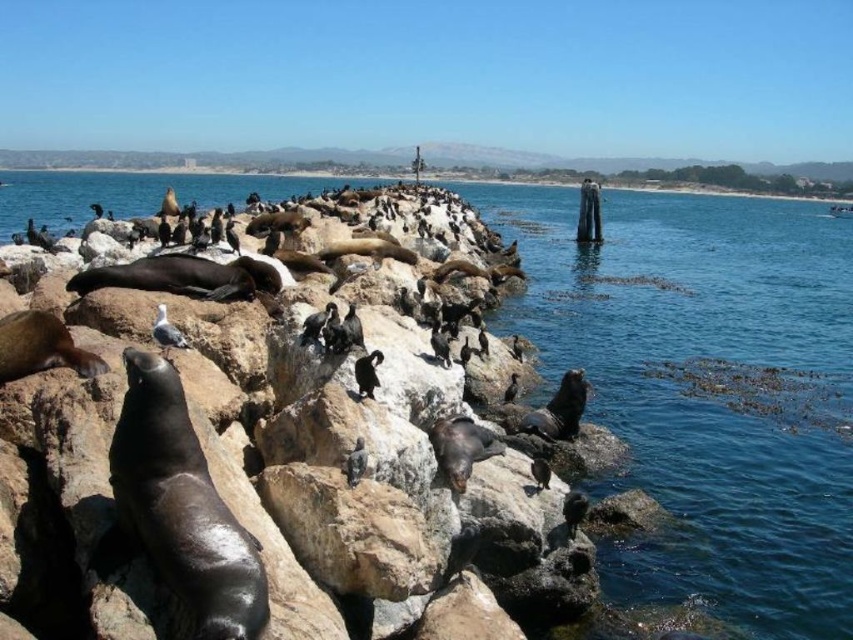
You are a drone operator trying to capture a photo of the coastal scene. You have two points marked on your screen, point A at point[810,211] and point B at point[4,419]. You need to ensure that point A is visible in the photo without being blocked by point B. Based on their positions, can you confirm if point A will be visible?

Point[810,211] is behind point[4,419], so it will be blocked by point B and not visible in the photo.

You are a marine biologist observing this coastal scene. You notice a specific point labeled as point (705, 388). Based on the scene description, what does this point most likely represent?

The point (705, 388) corresponds to clear blue water at center according to the scene description.

You are a marine biologist observing the coastal scene. You need to determine the spatial relationship between the clear blue water at center and the smooth rock at center. Which one is wider?

The clear blue water at center is narrower than the smooth rock at center because its width is less than the smooth rock at center.